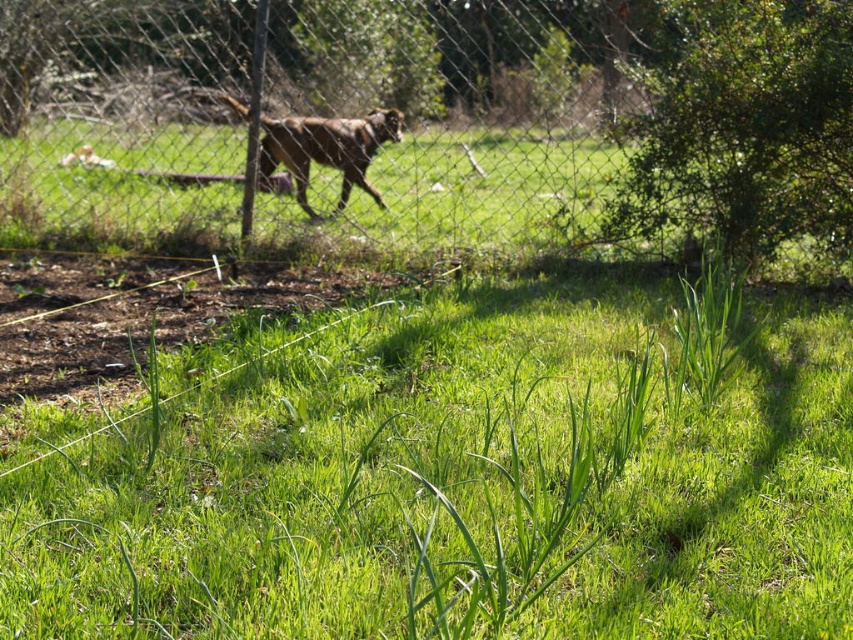
Question: Can you confirm if green grassy at center is bigger than metal mesh fence at upper center?

Choices:
 (A) yes
 (B) no

Answer: (B)

Question: Among these points, which one is nearest to the camera?

Choices:
 (A) (508, 612)
 (B) (338, 204)

Answer: (A)

Question: From the image, what is the correct spatial relationship of metal mesh fence at upper center in relation to brown furry dog at center?

Choices:
 (A) above
 (B) below

Answer: (A)

Question: Which object is the farthest from the green grassy at center?

Choices:
 (A) brown furry dog at center
 (B) metal mesh fence at upper center

Answer: (A)

Question: Observing the image, what is the correct spatial positioning of green grassy at center in reference to brown furry dog at center?

Choices:
 (A) left
 (B) right

Answer: (B)

Question: Among these objects, which one is nearest to the camera?

Choices:
 (A) metal mesh fence at upper center
 (B) green grassy at center
 (C) brown furry dog at center

Answer: (B)